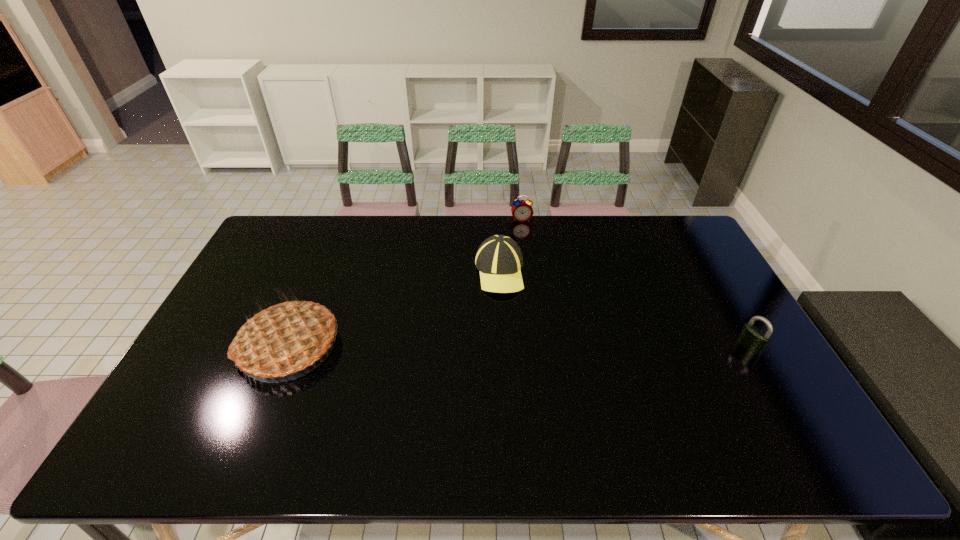
You are a GUI agent. You are given a task and a screenshot of the screen. Output one action in this format:
    pyautogui.click(x=<x>, y=<y>)
    Task: Click on the vacant area at the right edge of the desktop
    
    Given the screenshot: What is the action you would take?
    pyautogui.click(x=700, y=272)

You are a GUI agent. You are given a task and a screenshot of the screen. Output one action in this format:
    pyautogui.click(x=<x>, y=<y>)
    Task: Click on the vacant point at the far left corner
    The image size is (960, 540).
    Given the screenshot: What is the action you would take?
    pyautogui.click(x=274, y=233)

Find the location of a particular element. This screenshot has height=540, width=960. vacant area between the baseball cap and the rightmost object is located at coordinates (624, 309).

Identify the location of vacant area that lies between the second farthest object and the tallest object. The height and width of the screenshot is (540, 960). (395, 308).

Locate an element on the screen. free point between the padlock and the farthest object is located at coordinates (636, 282).

In order to click on free space between the pie and the alarm clock in this screenshot , I will do `click(405, 282)`.

This screenshot has width=960, height=540. What are the coordinates of `free space between the farthest object and the tallest object` in the screenshot? It's located at (405, 282).

Where is `free area in between the farthest object and the rightmost object`? The height and width of the screenshot is (540, 960). free area in between the farthest object and the rightmost object is located at coordinates (636, 282).

Find the location of a particular element. This screenshot has height=540, width=960. vacant area that lies between the third nearest object and the leftmost object is located at coordinates (395, 308).

This screenshot has width=960, height=540. Identify the location of empty space between the alarm clock and the leftmost object. (405, 282).